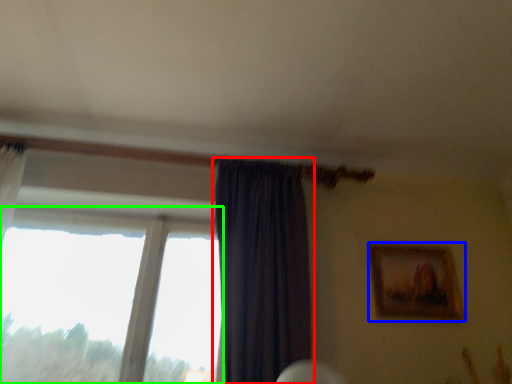
Question: Estimate the real-world distances between objects in this image. Which object is farther from curtain (highlighted by a red box), picture frame (highlighted by a blue box) or window (highlighted by a green box)?

Choices:
 (A) picture frame
 (B) window

Answer: (A)